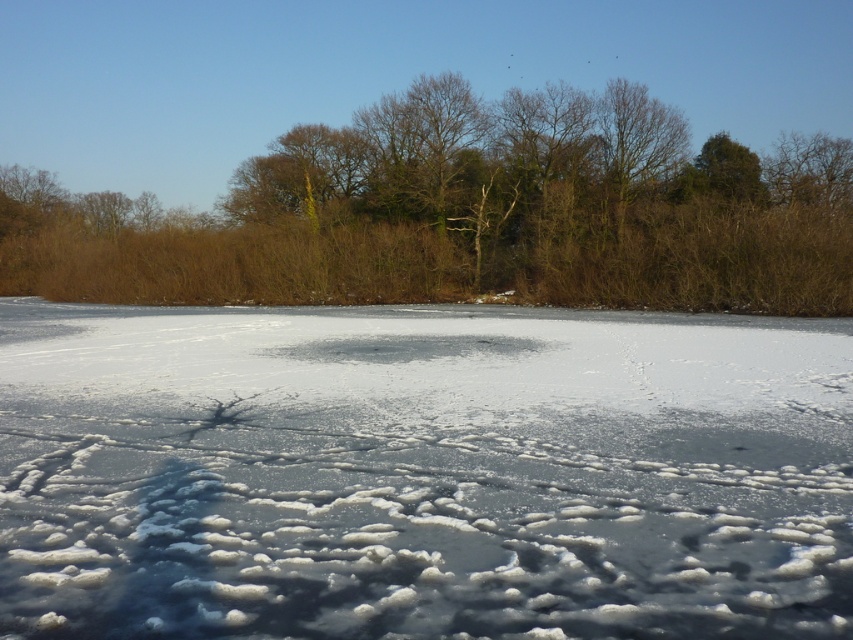
You are standing at the edge of the frozen lake and see the point labeled as point (422, 472). Based on the scene description, is this point located on transparent ice?

Yes, the point (422, 472) is on transparent ice at center according to the description.